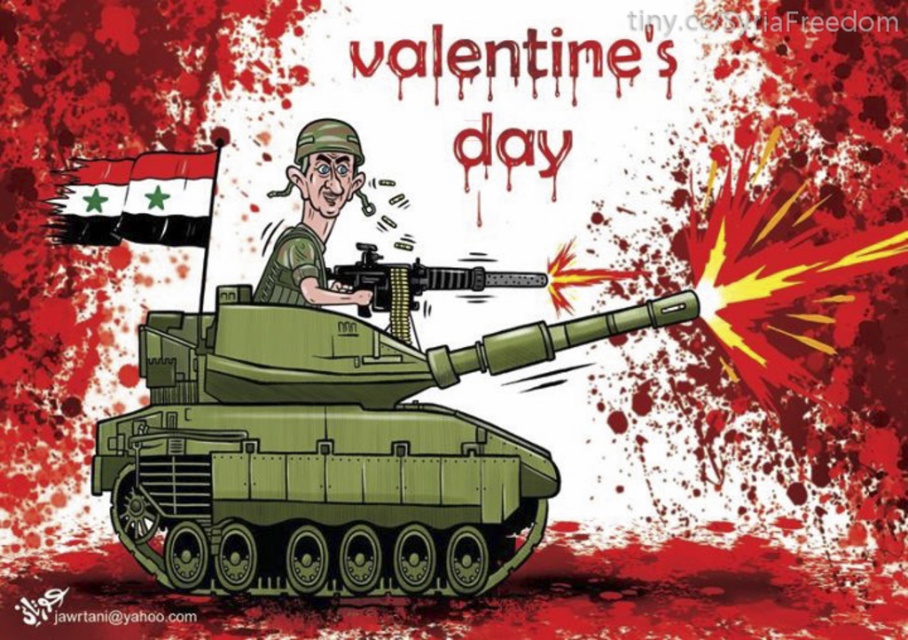
Question: Which of the following is the farthest from the observer?

Choices:
 (A) (333, 268)
 (B) (283, 278)
 (C) (129, 211)
 (D) (190, 465)

Answer: (A)

Question: Is matte green uniform at center below black matte machine gun at center?

Choices:
 (A) yes
 (B) no

Answer: (B)

Question: Is black fabric flag at upper left bigger than black matte machine gun at center?

Choices:
 (A) no
 (B) yes

Answer: (B)

Question: Which point is closer to the camera?

Choices:
 (A) (340, 168)
 (B) (262, 573)

Answer: (B)

Question: Is green matte tank at center in front of black fabric flag at upper left?

Choices:
 (A) yes
 (B) no

Answer: (A)

Question: Which is farther from the black matte machine gun at center?

Choices:
 (A) matte green uniform at center
 (B) green matte tank at center

Answer: (B)